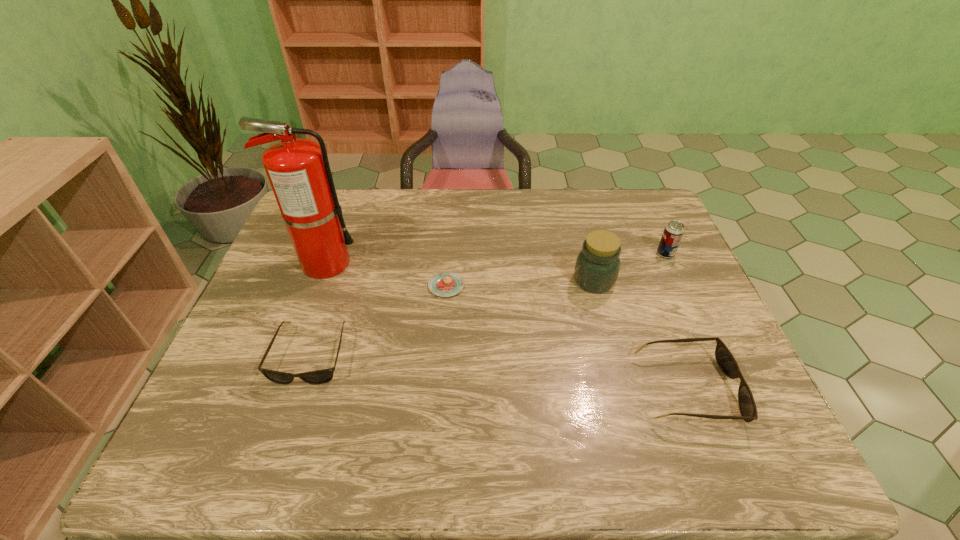
Please point a space for a new sunglasses to maintain equal intervals. Please provide its 2D coordinates. Your answer should be formatted as a tuple, i.e. [(x, y)], where the tuple contains the x and y coordinates of a point satisfying the conditions above.

[(492, 371)]